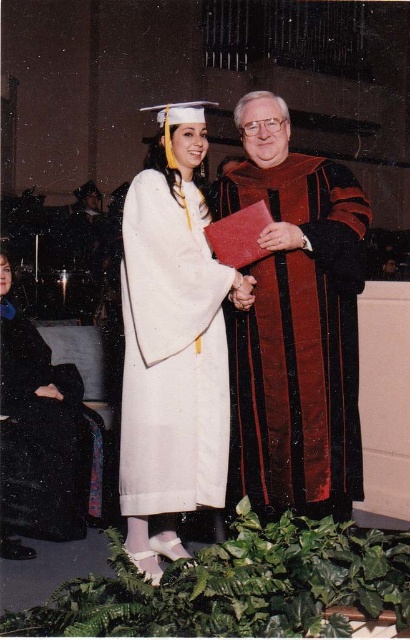
Question: Which of these objects is positioned farthest from the white matte graduation gown at center?

Choices:
 (A) black matte robe at lower left
 (B) velvet maroon gown at center

Answer: (A)

Question: Which of the following is the closest to the observer?

Choices:
 (A) white matte graduation gown at center
 (B) black matte robe at lower left
 (C) velvet maroon gown at center

Answer: (A)

Question: Does velvet maroon gown at center have a lesser width compared to white matte graduation gown at center?

Choices:
 (A) no
 (B) yes

Answer: (A)

Question: Is velvet maroon gown at center below white matte graduation gown at center?

Choices:
 (A) no
 (B) yes

Answer: (A)

Question: Which of the following is the farthest from the observer?

Choices:
 (A) white matte graduation gown at center
 (B) velvet maroon gown at center
 (C) black matte robe at lower left

Answer: (C)

Question: Does velvet maroon gown at center appear under black matte robe at lower left?

Choices:
 (A) no
 (B) yes

Answer: (A)